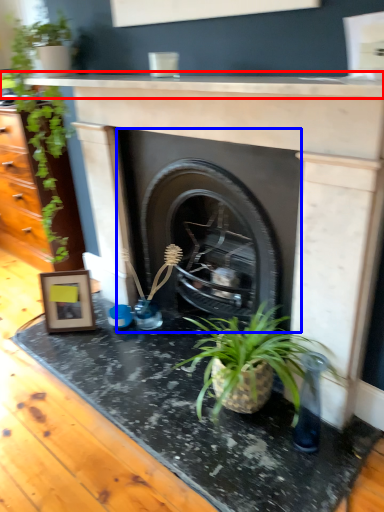
Question: Which object is further to the camera taking this photo, counter top (highlighted by a red box) or fireplace (highlighted by a blue box)?

Choices:
 (A) counter top
 (B) fireplace

Answer: (B)